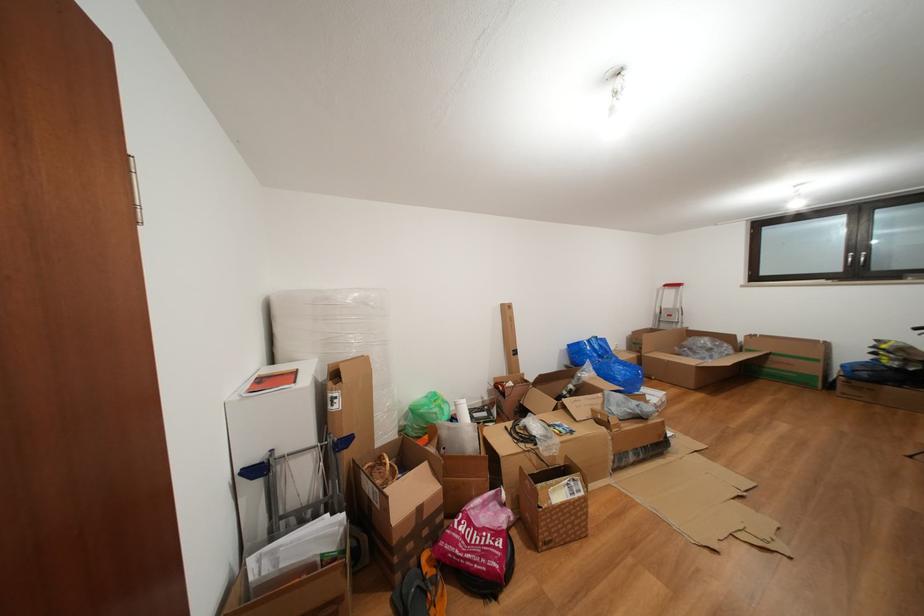
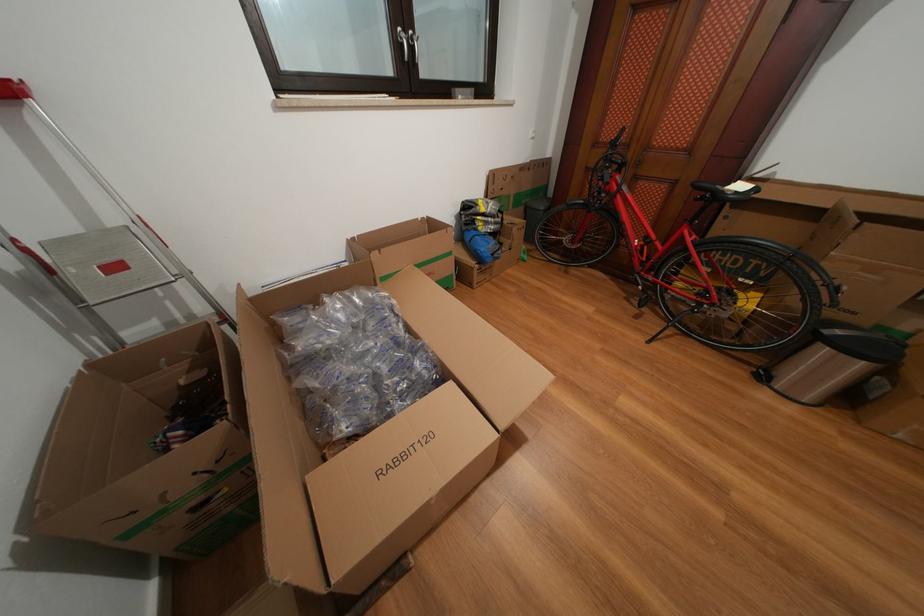
Where in the second image is the point corresponding to point (892, 352) from the first image?

(491, 215)